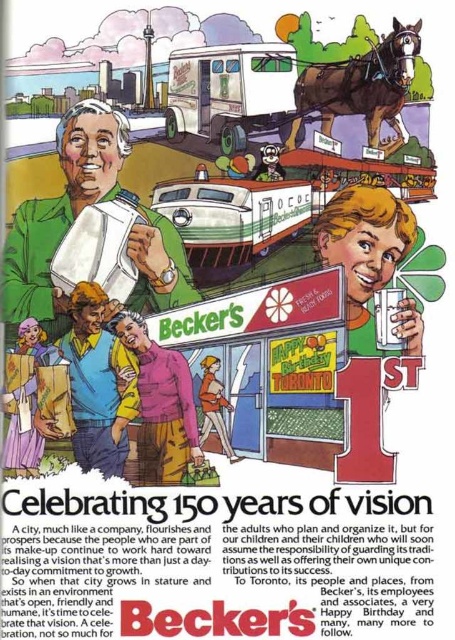
Does point (75, 445) come closer to viewer compared to point (203, 422)?

Yes, it is.

Locate an element on the screen. blue denim jeans at lower center is located at coordinates (99, 381).

Who is more distant from viewer, (176, 355) or (213, 376)?

The point (213, 376) is behind.

Does pink fabric shirt at center appear over orange fabric jacket at center?

Correct, pink fabric shirt at center is located above orange fabric jacket at center.

Which is behind, point (181, 424) or point (210, 362)?

The point (210, 362) is more distant.

The width and height of the screenshot is (455, 640). What are the coordinates of `pink fabric shirt at center` in the screenshot? It's located at [x=161, y=404].

Between smooth plastic cup at center and pink fabric shirt at center, which one appears on the left side from the viewer's perspective?

Positioned to the left is pink fabric shirt at center.

Which of these two, smooth plastic cup at center or pink fabric shirt at center, stands taller?

pink fabric shirt at center

Is point (348, 307) positioned in front of point (188, 452)?

No, it is behind (188, 452).

Identify the location of smooth plastic cup at center. This screenshot has height=640, width=455. coord(364,250).